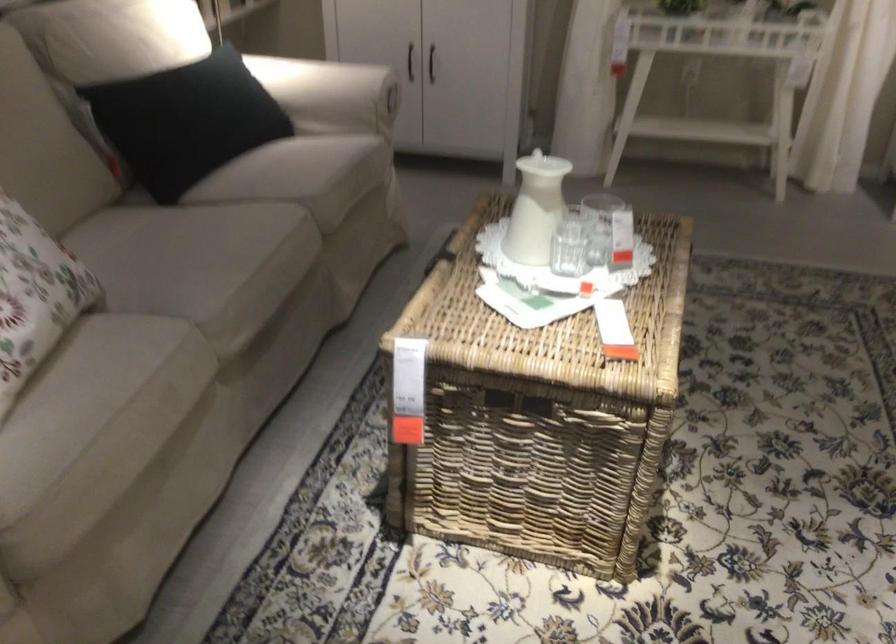
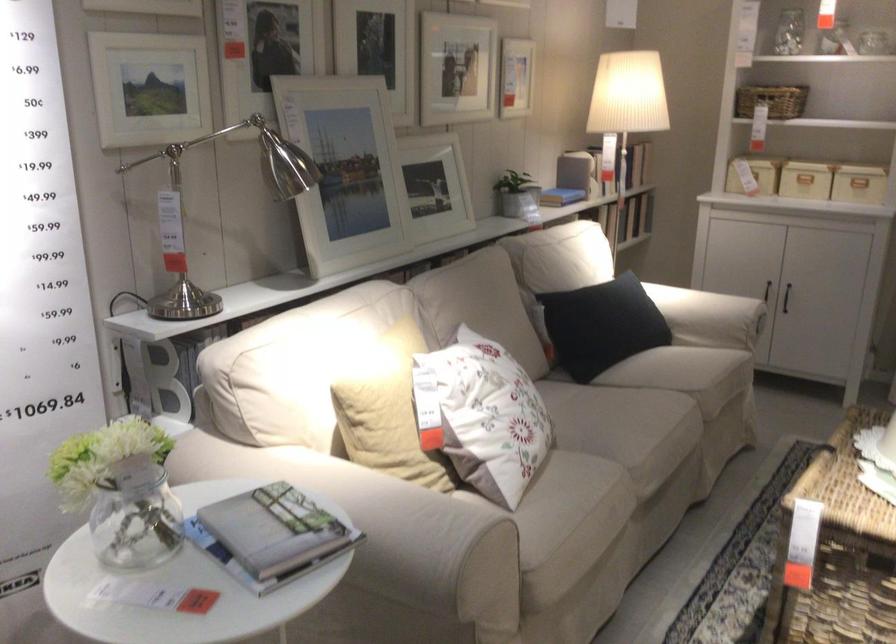
In the second image, find the point that corresponds to (x=156, y=290) in the first image.

(596, 442)